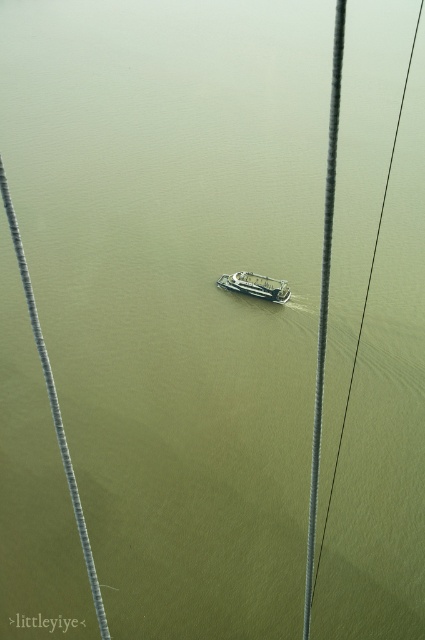
You are a bird flying over the water and want to land on the metallic gray cable at center or the metallic wire at center. Which one is narrower so you can land safely?

The metallic gray cable at center is smaller than the metallic wire at center, so it is narrower and safer for the bird to land there.

You are a drone operator trying to capture a photo of the metallic wire at center. Your drone is currently at the point with coordinates point (365, 301). Is the drone positioned directly above the metallic wire at center?

The point (365, 301) indicates the location of the metallic wire at center, so yes, the drone is positioned directly above the metallic wire at center.

You are standing on the bridge and notice the metallic wire at center and the green metallic boat at center below. Which object is closer to the right edge of the bridge?

The metallic wire at center is positioned on the right side of the green metallic boat at center, so it is closer to the right edge of the bridge.